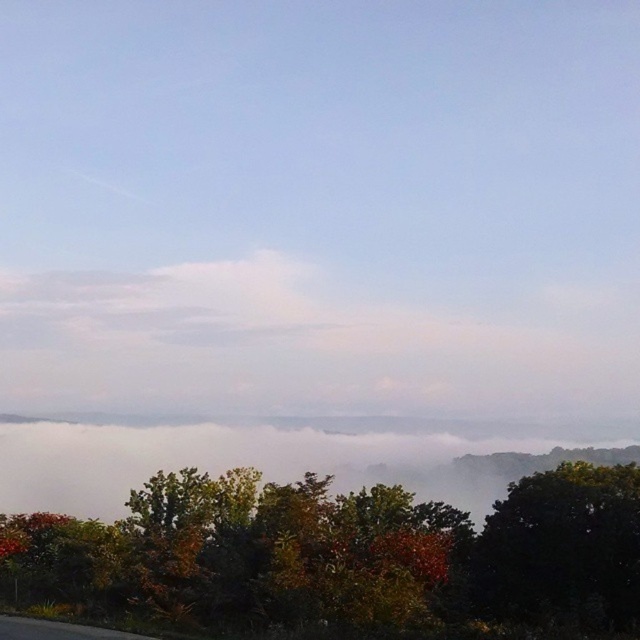
Who is positioned more to the left, white fluffy cloud at center or green leafy tree at center?

white fluffy cloud at center

Can you confirm if white fluffy cloud at center is positioned below green leafy tree at center?

No.

The width and height of the screenshot is (640, 640). I want to click on white fluffy cloud at center, so click(x=301, y=348).

In the scene shown: Is green matte tree at lower center to the right of green leafy tree at center from the viewer's perspective?

Incorrect, green matte tree at lower center is not on the right side of green leafy tree at center.

Find the location of a particular element. This screenshot has height=640, width=640. green matte tree at lower center is located at coordinates (340, 557).

Which is in front, point (408, 534) or point (589, 614)?

Point (589, 614)

Find the location of a particular element. green matte tree at lower center is located at coordinates (340, 557).

Is green matte tree at lower center below white fluffy cloud at center?

Indeed, green matte tree at lower center is positioned under white fluffy cloud at center.

Who is more distant from viewer, (212,627) or (200,323)?

Positioned behind is point (200,323).

In order to click on green matte tree at lower center in this screenshot , I will do `click(340, 557)`.